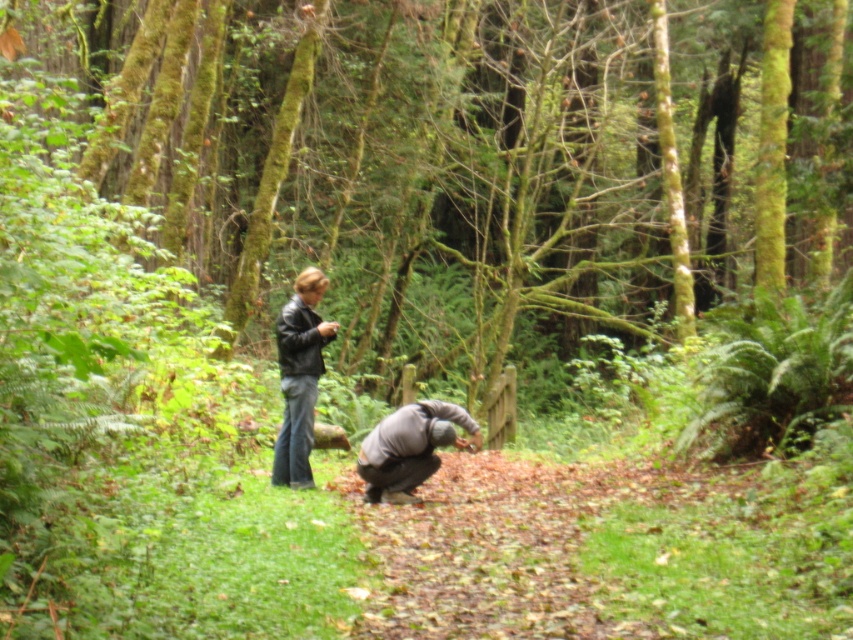
You are a hiker in the forest and see a point marked at coordinates (299, 376). What object is this point located on?

The point at coordinates (299, 376) is located on the matte black jacket at center.

You are a hiker trying to locate two people in the forest. You see the matte black jacket at center and the gray matte jacket at lower center. Which jacket is higher up in the image?

The matte black jacket at center is positioned over the gray matte jacket at lower center, so it is higher up in the image.

Based on the photo, you are a photographer in the forest. You want to take a photo of the gray matte jacket at lower center without the matte black jacket at center blocking it. Is this possible?

The gray matte jacket at lower center is behind the matte black jacket at center, so it is currently blocked by the matte black jacket at center. To take a photo of the gray matte jacket at lower center without obstruction, you would need to move either yourself or the subjects to reposition them so that the gray matte jacket at lower center is no longer behind the matte black jacket at center.